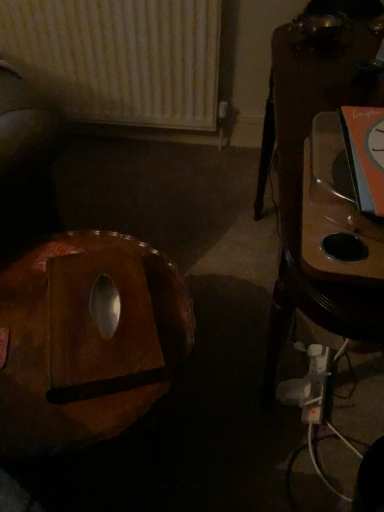
I want to click on wooden table at right, so click(x=302, y=175).

In order to click on white textured radiator at upper left in this screenshot , I will do `click(120, 58)`.

Is the depth of brown leather bean bag chair at lower left greater than that of white textured radiator at upper left?

No, it is not.

Which is closer to the camera, (66, 377) or (159, 20)?

The point (66, 377) is closer.

Can you confirm if brown leather bean bag chair at lower left is taller than white textured radiator at upper left?

Incorrect, the height of brown leather bean bag chair at lower left is not larger of that of white textured radiator at upper left.

How far apart are brown leather bean bag chair at lower left and white textured radiator at upper left?

They are 4.33 feet apart.

Consider the image. From a real-world perspective, is brown leather bean bag chair at lower left over wooden table at right?

No, from a real-world perspective, brown leather bean bag chair at lower left is not above wooden table at right.

Is brown leather bean bag chair at lower left not near wooden table at right?

No.

From the image's perspective, who appears lower, brown leather bean bag chair at lower left or wooden table at right?

brown leather bean bag chair at lower left appears lower in the image.

Is brown leather bean bag chair at lower left aimed at wooden table at right?

No, brown leather bean bag chair at lower left is not aimed at wooden table at right.

Considering the relative positions of wooden table at right and white textured radiator at upper left in the image provided, is wooden table at right in front of white textured radiator at upper left?

Yes, it is in front of white textured radiator at upper left.

What's the angular difference between wooden table at right and white textured radiator at upper left's facing directions?

There is a 90-degree angle between the facing directions of wooden table at right and white textured radiator at upper left.

From a real-world perspective, who is located lower, wooden table at right or white textured radiator at upper left?

In real-world perspective, wooden table at right is lower.

Measure the distance between wooden table at right and white textured radiator at upper left.

wooden table at right and white textured radiator at upper left are 36.98 inches apart.

Which of these two, white textured radiator at upper left or brown leather bean bag chair at lower left, stands taller?

With more height is white textured radiator at upper left.

From a real-world perspective, is white textured radiator at upper left located beneath brown leather bean bag chair at lower left?

Actually, white textured radiator at upper left is physically above brown leather bean bag chair at lower left in the real world.

Which object is positioned more to the right, white textured radiator at upper left or brown leather bean bag chair at lower left?

From the viewer's perspective, brown leather bean bag chair at lower left appears more on the right side.

In the image, there is a brown leather bean bag chair at lower left. Identify the location of furniture above it (from the image's perspective). (x=302, y=175).

From the image's perspective, which is below, wooden table at right or brown leather bean bag chair at lower left?

brown leather bean bag chair at lower left, from the image's perspective.

Find the location of `furniture that appears below the white textured radiator at upper left (from the image's perspective)`. furniture that appears below the white textured radiator at upper left (from the image's perspective) is located at coordinates (302, 175).

From the image's perspective, does white textured radiator at upper left appear lower than wooden table at right?

No, from the image's perspective, white textured radiator at upper left is not beneath wooden table at right.

From the picture: From a real-world perspective, between white textured radiator at upper left and wooden table at right, who is vertically higher?

In real-world perspective, white textured radiator at upper left is above.

Between white textured radiator at upper left and wooden table at right, which one appears on the right side from the viewer's perspective?

wooden table at right is more to the right.

This screenshot has width=384, height=512. Identify the location of radiator above the brown leather bean bag chair at lower left (from a real-world perspective). (120, 58).

Image resolution: width=384 pixels, height=512 pixels. I want to click on furniture in front of the brown leather bean bag chair at lower left, so click(x=302, y=175).

Based on their spatial positions, is white textured radiator at upper left or wooden table at right closer to brown leather bean bag chair at lower left?

wooden table at right lies closer to brown leather bean bag chair at lower left than the other object.

Considering their positions, is brown leather bean bag chair at lower left positioned further to white textured radiator at upper left than wooden table at right?

brown leather bean bag chair at lower left lies further to white textured radiator at upper left than the other object.

Consider the image. From the image, which object appears to be farther from brown leather bean bag chair at lower left, wooden table at right or white textured radiator at upper left?

white textured radiator at upper left.

Based on their spatial positions, is wooden table at right or brown leather bean bag chair at lower left further from white textured radiator at upper left?

brown leather bean bag chair at lower left lies further to white textured radiator at upper left than the other object.

Looking at the image, which one is located further to wooden table at right, white textured radiator at upper left or brown leather bean bag chair at lower left?

white textured radiator at upper left lies further to wooden table at right than the other object.

From the image, which object appears to be farther from wooden table at right, brown leather bean bag chair at lower left or white textured radiator at upper left?

The object further to wooden table at right is white textured radiator at upper left.

Identify the location of bean bag chair located between wooden table at right and white textured radiator at upper left in the depth direction. (86, 339).